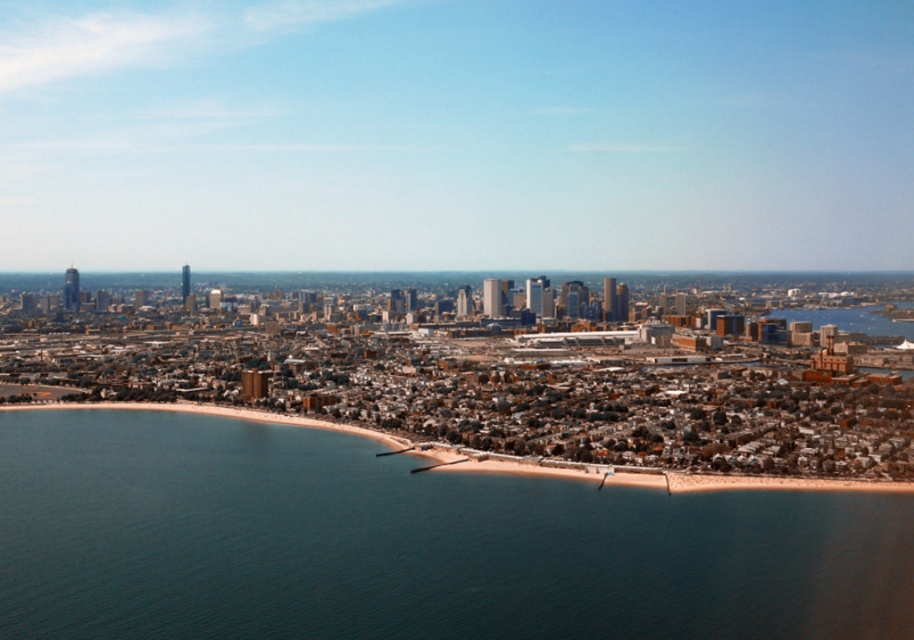
Question: Is blue water at lower left closer to camera compared to smooth sand beach at lower center?

Choices:
 (A) yes
 (B) no

Answer: (B)

Question: Can you confirm if blue water at lower left is positioned below smooth sand beach at lower center?

Choices:
 (A) no
 (B) yes

Answer: (B)

Question: Which point is closer to the camera taking this photo?

Choices:
 (A) (859, 625)
 (B) (576, 472)

Answer: (B)

Question: Which object appears closest to the camera in this image?

Choices:
 (A) blue water at lower left
 (B) smooth sand beach at lower center

Answer: (B)

Question: Can you confirm if blue water at lower left is thinner than smooth sand beach at lower center?

Choices:
 (A) no
 (B) yes

Answer: (B)